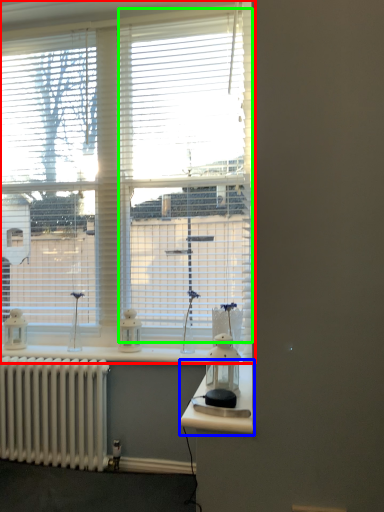
Question: Which object is the closest to the window (highlighted by a red box)? Choose among these: table (highlighted by a blue box) or window (highlighted by a green box).

Choices:
 (A) table
 (B) window

Answer: (B)